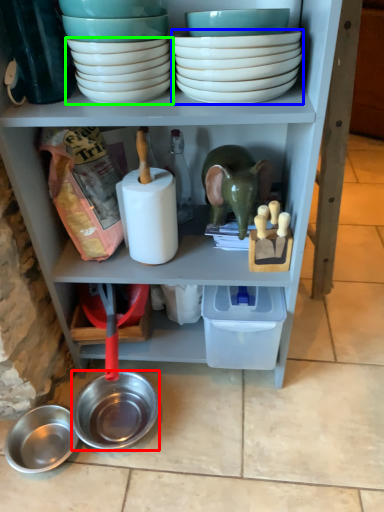
Question: Estimate the real-world distances between objects in this image. Which object is closer to bowl (highlighted by a red box), bowl (highlighted by a blue box) or bowl (highlighted by a green box)?

Choices:
 (A) bowl
 (B) bowl

Answer: (B)